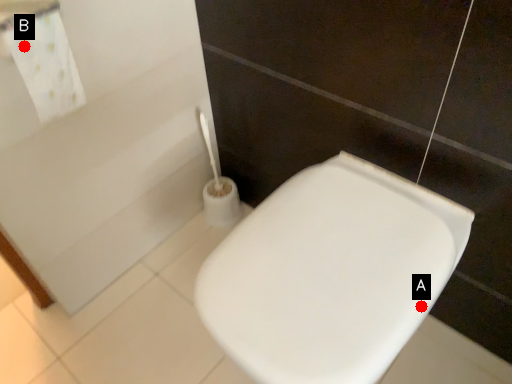
Question: Two points are circled on the image, labeled by A and B beside each circle. Among these points, which one is nearest to the camera?

Choices:
 (A) A is closer
 (B) B is closer

Answer: (B)